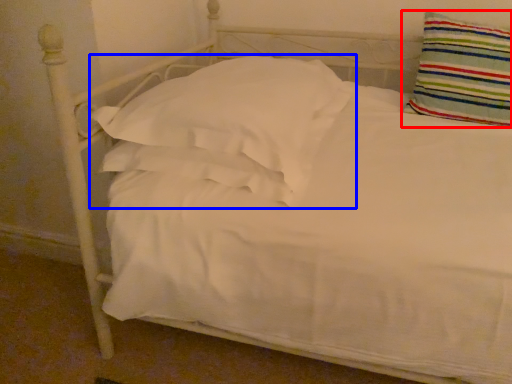
Question: Which object is closer to the camera taking this photo, pillow (highlighted by a red box) or pillow (highlighted by a blue box)?

Choices:
 (A) pillow
 (B) pillow

Answer: (B)